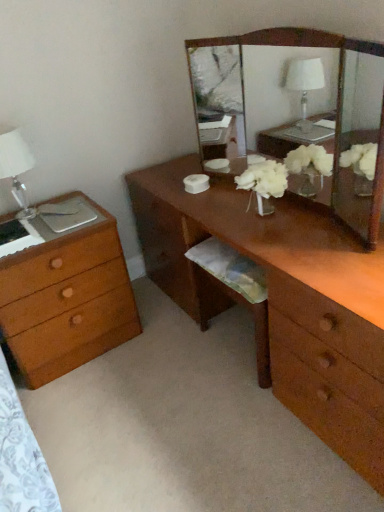
Where is `free space on the front side of wooden chest of drawers at left`? Image resolution: width=384 pixels, height=512 pixels. free space on the front side of wooden chest of drawers at left is located at coordinates (87, 402).